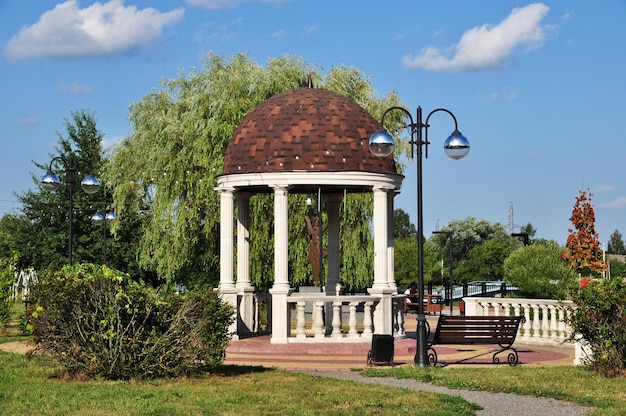
Locate an element on the screen. This screenshot has height=416, width=626. bench is located at coordinates (467, 338).